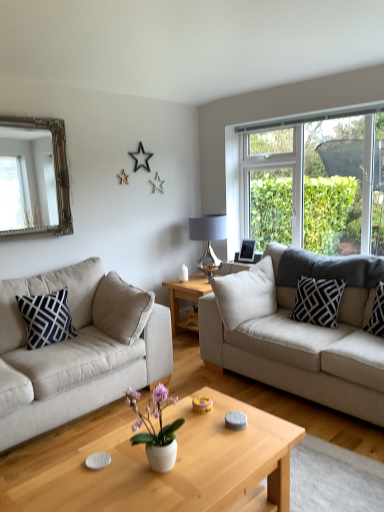
Locate an element on the screen. The width and height of the screenshot is (384, 512). blank space situated above silver/gilded mirror at upper left (from a real-world perspective) is located at coordinates (23, 117).